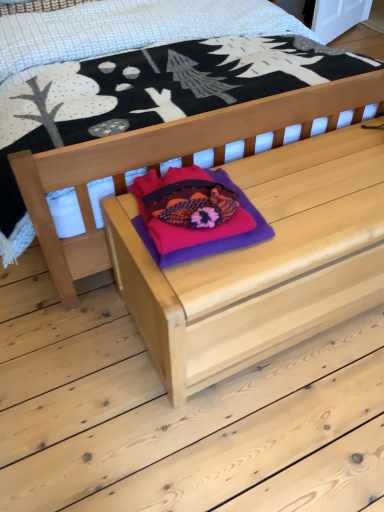
Locate an element on the screen. vacant area located to the right-hand side of purple felt throw pillow at center is located at coordinates (298, 202).